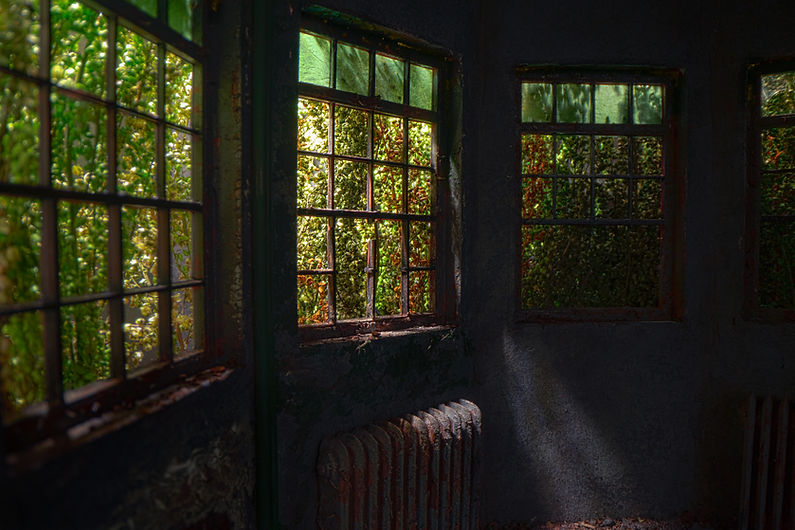
Find the location of a particular element. broken frame is located at coordinates (366, 273), (398, 273).